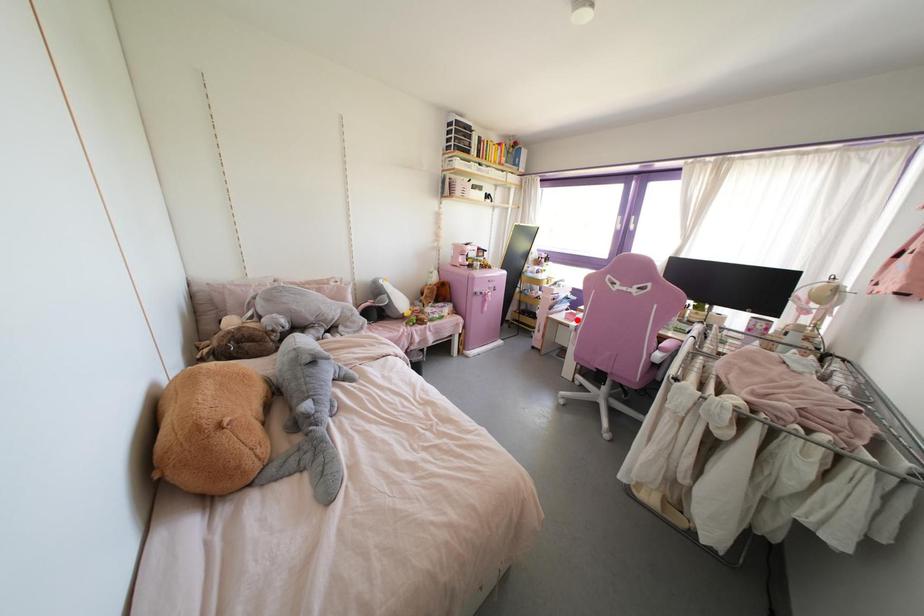
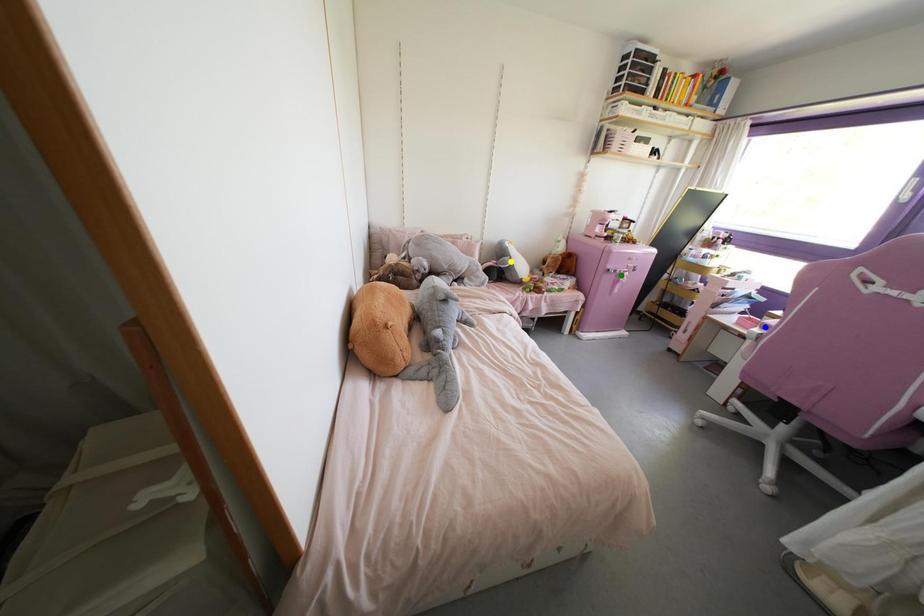
Question: I am providing you with two images of the same scene from different viewpoints. A red point is marked on the first image. You are given multiple points on the second image. Which mark in image 2 goes with the point in image 1?

Choices:
 (A) green point
 (B) blue point
 (C) yellow point

Answer: (B)